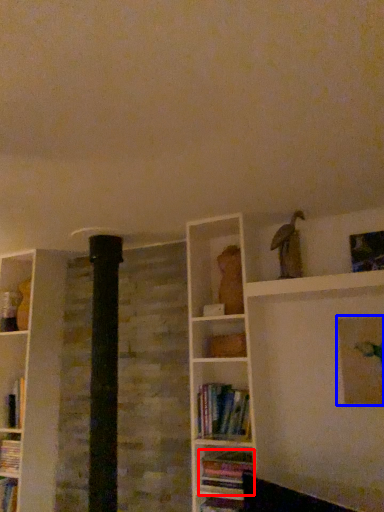
Question: Which object appears closest to the camera in this image, book (highlighted by a red box) or picture frame (highlighted by a blue box)?

Choices:
 (A) book
 (B) picture frame

Answer: (B)